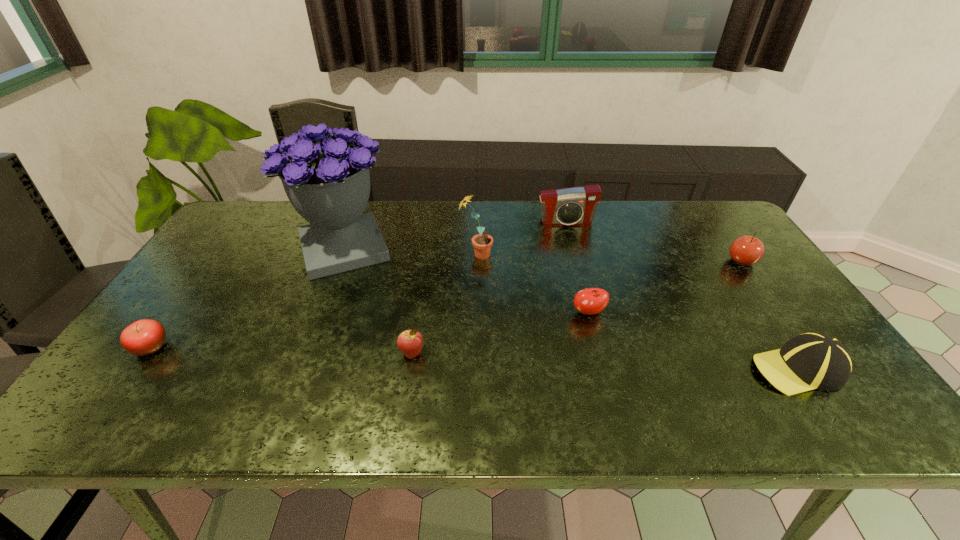
Find the location of `the seventh object from right to left`. the seventh object from right to left is located at coordinates (328, 184).

Where is `bouquet`? The height and width of the screenshot is (540, 960). bouquet is located at coordinates (328, 184).

You are a GUI agent. You are given a task and a screenshot of the screen. Output one action in this format:
    pyautogui.click(x=<x>, y=<y>)
    Task: Click on the fourth object from left to right
    This screenshot has height=540, width=960.
    Given the screenshot: What is the action you would take?
    pyautogui.click(x=482, y=243)

The image size is (960, 540). Identify the location of the seventh shortest object. pyautogui.click(x=482, y=243).

Where is `camera`? This screenshot has height=540, width=960. camera is located at coordinates (577, 205).

What are the coordinates of `the rightmost apple` in the screenshot? It's located at (746, 250).

This screenshot has width=960, height=540. Find the location of `the third nearest apple`. the third nearest apple is located at coordinates (589, 301).

Locate an element on the screen. The image size is (960, 540). the fourth nearest object is located at coordinates (589, 301).

Find the location of a particular element. the second apple from left to right is located at coordinates click(410, 342).

You are a GUI agent. You are given a task and a screenshot of the screen. Output one action in this format:
    pyautogui.click(x=<x>, y=<y>)
    Task: Click on the baseball cap
    
    Given the screenshot: What is the action you would take?
    pyautogui.click(x=809, y=361)